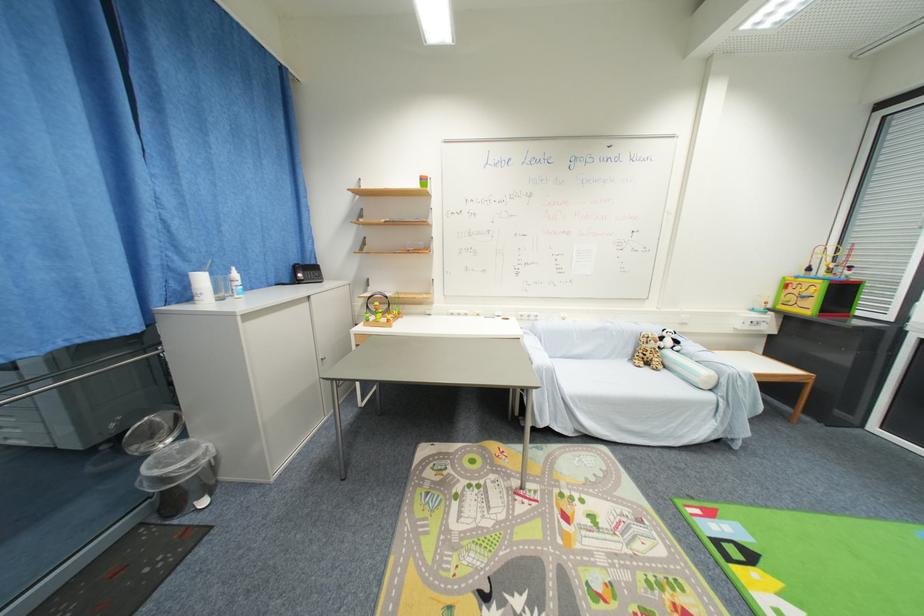
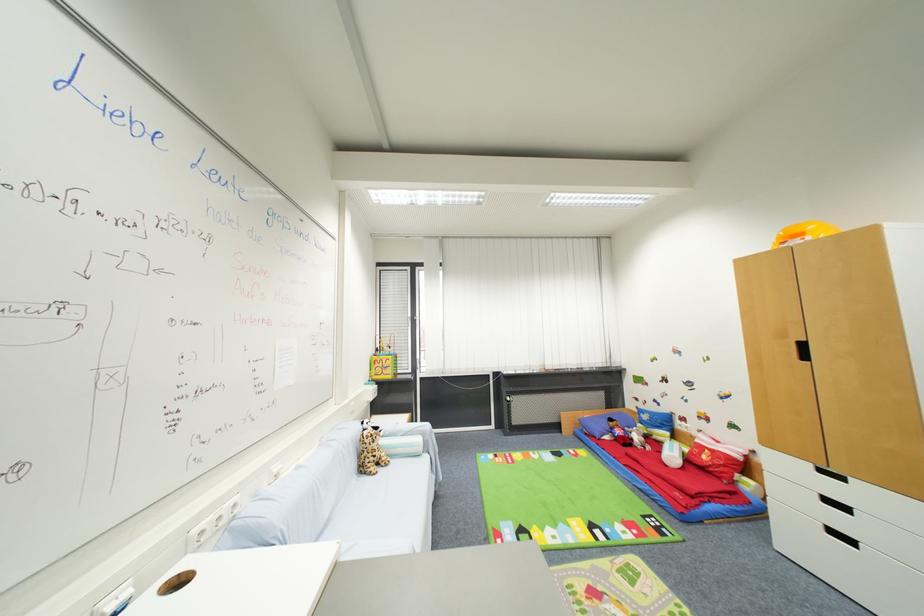
In the second image, find the point that corresponds to the point at 638,361 in the first image.

(367, 472)